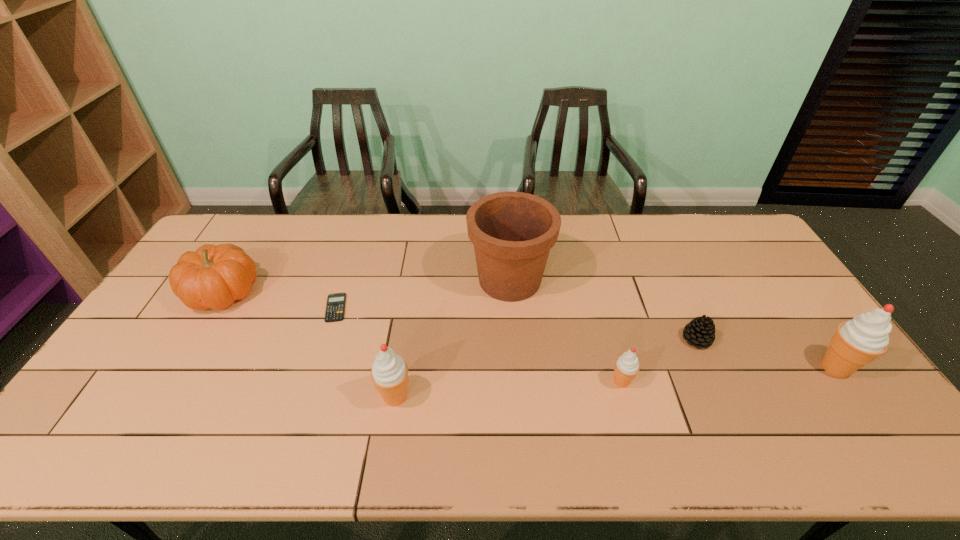
Find the location of a particular element. The width and height of the screenshot is (960, 540). the fourth shortest object is located at coordinates (214, 276).

The height and width of the screenshot is (540, 960). What are the coordinates of `the leftmost object` in the screenshot? It's located at (214, 276).

Identify the location of vacant region located 0.080m on the right of the fifth shortest object. The image size is (960, 540). (444, 397).

Identify the location of free space located on the back of the shortest icecream. The height and width of the screenshot is (540, 960). (592, 275).

Image resolution: width=960 pixels, height=540 pixels. Identify the location of vacant space situated 0.070m on the left of the rightmost icecream. (790, 368).

Identify the location of free region located on the left of the calculator. The width and height of the screenshot is (960, 540). (216, 308).

You are a GUI agent. You are given a task and a screenshot of the screen. Output one action in this format:
    pyautogui.click(x=<x>, y=<y>)
    Task: Click on the vacant space situated 0.220m on the right of the flowerpot
    
    Given the screenshot: What is the action you would take?
    pyautogui.click(x=620, y=280)

At what (x,y) coordinates should I click in order to perform the action: click on vacant space located at the narrow end of the second object from right to left. Please return your answer as a coordinate pair (x, y). Image resolution: width=960 pixels, height=540 pixels. Looking at the image, I should click on (544, 340).

Find the location of a particular element. This screenshot has width=960, height=540. vacant space located 0.200m at the narrow end of the second object from right to left is located at coordinates (612, 340).

The image size is (960, 540). What are the coordinates of `free space located at the narrow end of the second object from right to left` in the screenshot? It's located at (622, 340).